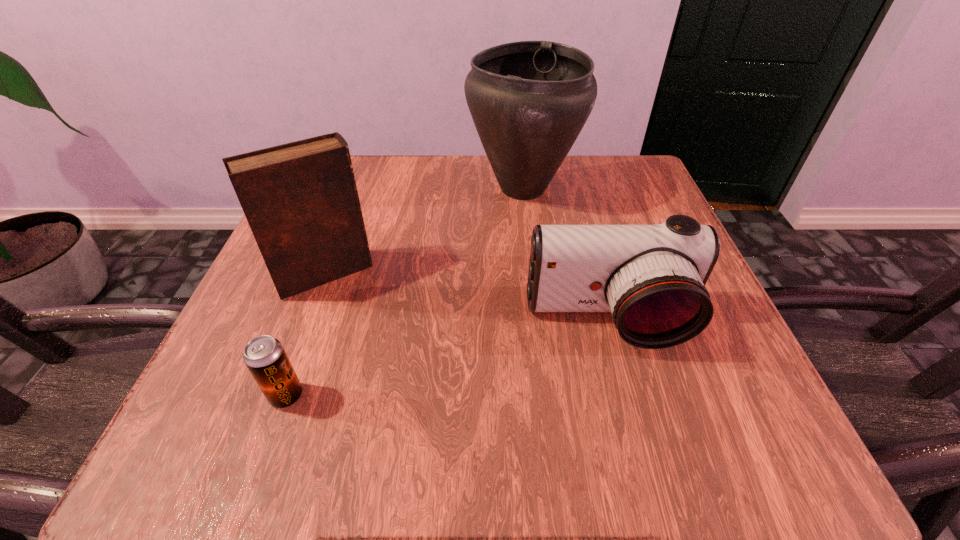
The width and height of the screenshot is (960, 540). In order to click on the farthest object in this screenshot , I will do (529, 100).

Locate an element on the screen. Image resolution: width=960 pixels, height=540 pixels. the tallest object is located at coordinates (529, 100).

This screenshot has width=960, height=540. In order to click on the second tallest object in this screenshot , I will do `click(300, 199)`.

Where is `camcorder`? This screenshot has width=960, height=540. camcorder is located at coordinates (652, 278).

The height and width of the screenshot is (540, 960). What are the coordinates of `the nearest object` in the screenshot? It's located at (264, 356).

Where is `beer can`? beer can is located at coordinates (264, 356).

I want to click on free space located on the front of the farthest object, so [532, 259].

Locate an element on the screen. vacant space located 0.200m on the right of the Bible is located at coordinates (485, 274).

Locate an element on the screen. The height and width of the screenshot is (540, 960). free region located on the surface of the second shortest object is located at coordinates (639, 433).

You are a GUI agent. You are given a task and a screenshot of the screen. Output one action in this format:
    pyautogui.click(x=<x>, y=<y>)
    Task: Click on the vacant area located on the back of the nearest object
    This screenshot has width=960, height=540.
    Given the screenshot: What is the action you would take?
    pyautogui.click(x=313, y=322)